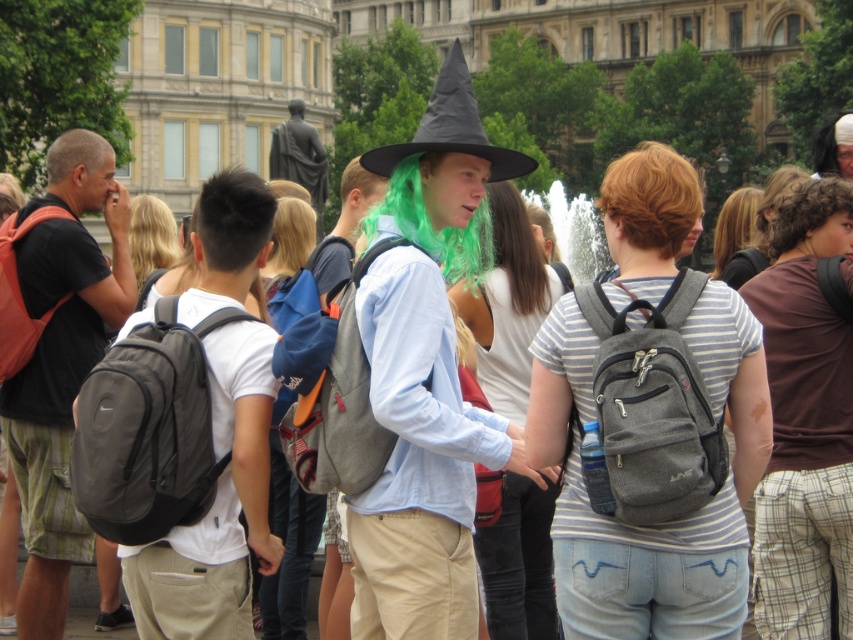
Question: Can you confirm if blonde curly hair at upper right is thinner than black felt wizard hat at center?

Choices:
 (A) no
 (B) yes

Answer: (A)

Question: Is blonde curly hair at upper right to the right of black felt wizard hat at center from the viewer's perspective?

Choices:
 (A) no
 (B) yes

Answer: (B)

Question: Which point appears farthest from the camera in this image?

Choices:
 (A) (633, 186)
 (B) (456, 118)

Answer: (B)

Question: Does blonde curly hair at upper right appear under black felt wizard hat at center?

Choices:
 (A) yes
 (B) no

Answer: (A)

Question: Which of the following is the farthest from the observer?

Choices:
 (A) (413, 145)
 (B) (633, 243)

Answer: (B)